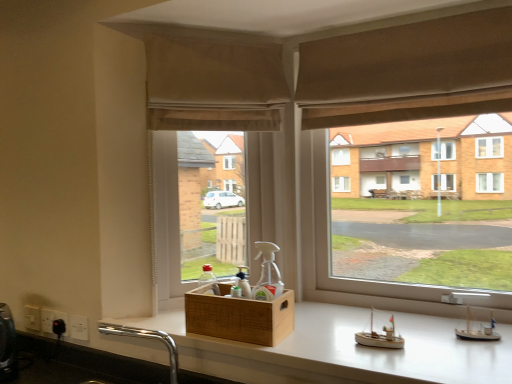
Question: Does beige fabric window screen at center have a lesser height compared to brown fabric curtain at upper center?

Choices:
 (A) no
 (B) yes

Answer: (A)

Question: Is brown fabric curtain at upper center inside beige fabric window screen at center?

Choices:
 (A) yes
 (B) no

Answer: (B)

Question: Does beige fabric window screen at center have a smaller size compared to brown fabric curtain at upper center?

Choices:
 (A) no
 (B) yes

Answer: (A)

Question: Considering the relative positions of beige fabric window screen at center and brown fabric curtain at upper center in the image provided, is beige fabric window screen at center to the left of brown fabric curtain at upper center from the viewer's perspective?

Choices:
 (A) yes
 (B) no

Answer: (A)

Question: Is beige fabric window screen at center aimed at brown fabric curtain at upper center?

Choices:
 (A) no
 (B) yes

Answer: (A)

Question: Does point (226, 359) appear closer or farther from the camera than point (259, 297)?

Choices:
 (A) farther
 (B) closer

Answer: (B)

Question: Would you say white glossy counter at center is to the left or to the right of transparent plastic spray bottle at center, the first bottle in the right-to-left sequence, in the picture?

Choices:
 (A) right
 (B) left

Answer: (A)

Question: Considering the positions of white glossy counter at center and transparent plastic spray bottle at center, the first bottle in the right-to-left sequence, in the image, is white glossy counter at center taller or shorter than transparent plastic spray bottle at center, the first bottle in the right-to-left sequence,?

Choices:
 (A) tall
 (B) short

Answer: (B)

Question: From a real-world perspective, relative to transparent plastic spray bottle at center, the first bottle in the right-to-left sequence, is white glossy counter at center vertically above or below?

Choices:
 (A) above
 (B) below

Answer: (B)

Question: Relative to transparent plastic spray bottle at center, the first bottle in the right-to-left sequence, is brown fabric curtain at upper center in front or behind?

Choices:
 (A) front
 (B) behind

Answer: (A)

Question: Is brown fabric curtain at upper center taller or shorter than transparent plastic spray bottle at center, the first bottle in the right-to-left sequence?

Choices:
 (A) tall
 (B) short

Answer: (A)

Question: In terms of width, does brown fabric curtain at upper center look wider or thinner when compared to transparent plastic spray bottle at center, the first bottle in the right-to-left sequence?

Choices:
 (A) thin
 (B) wide

Answer: (B)

Question: Based on their positions, is brown fabric curtain at upper center located to the left or right of transparent plastic spray bottle at center, which appears as the second bottle when viewed from the left?

Choices:
 (A) left
 (B) right

Answer: (B)

Question: Considering the positions of translucent plastic bottle at lower left, the first bottle positioned from the left, and wooden crate at center in the image, is translucent plastic bottle at lower left, the first bottle positioned from the left, wider or thinner than wooden crate at center?

Choices:
 (A) thin
 (B) wide

Answer: (A)

Question: From a real-world perspective, is translucent plastic bottle at lower left, the second bottle when ordered from right to left, physically located above or below wooden crate at center?

Choices:
 (A) above
 (B) below

Answer: (A)